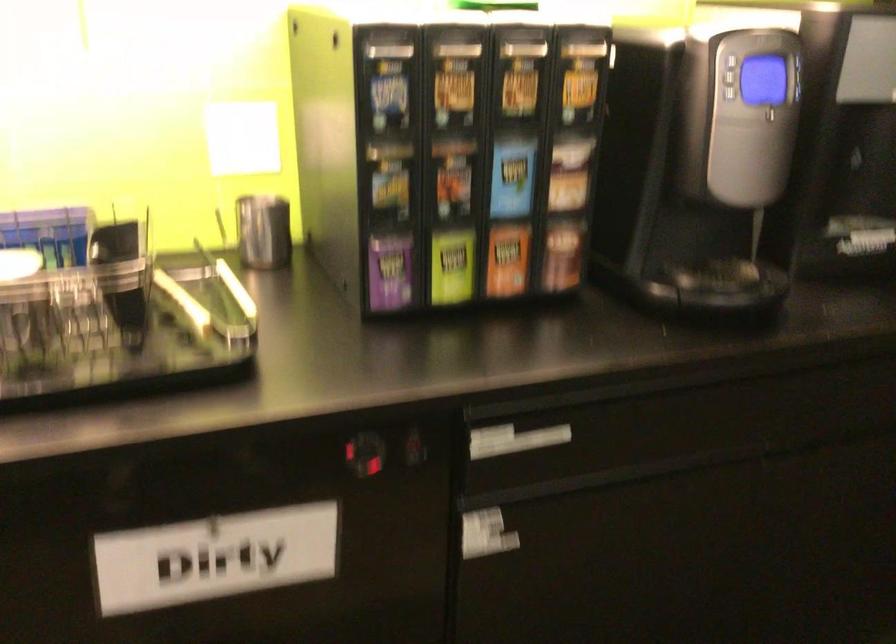
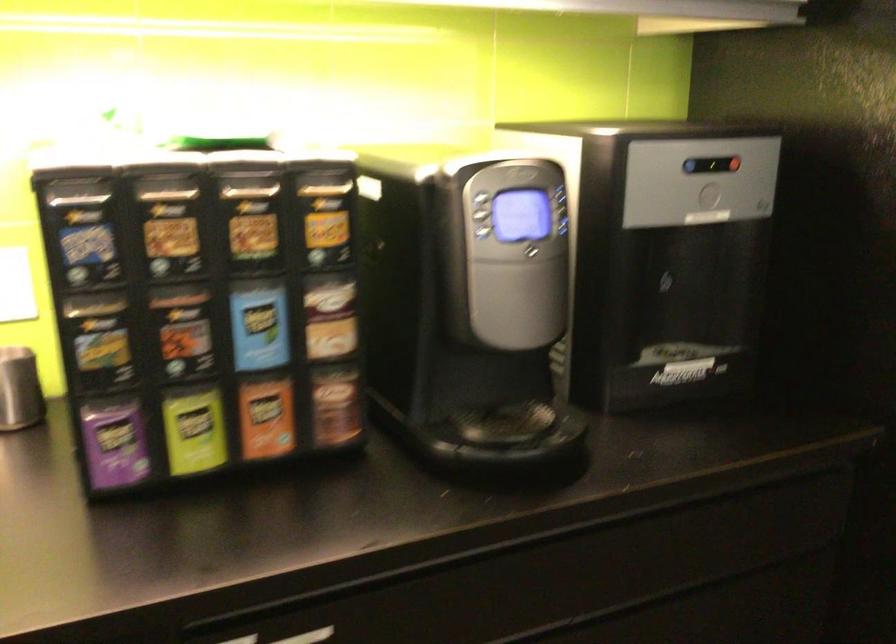
Find the pixel in the second image that matches point (800, 93) in the first image.

(565, 227)